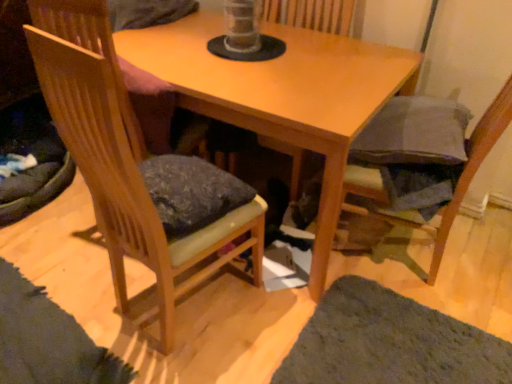
Locate an element on the screen. This screenshot has width=512, height=384. free space that is in between dark gray fabric cushion at lower right, which is the 1th chair from right to left, and green shaggy rug at lower right is located at coordinates (438, 301).